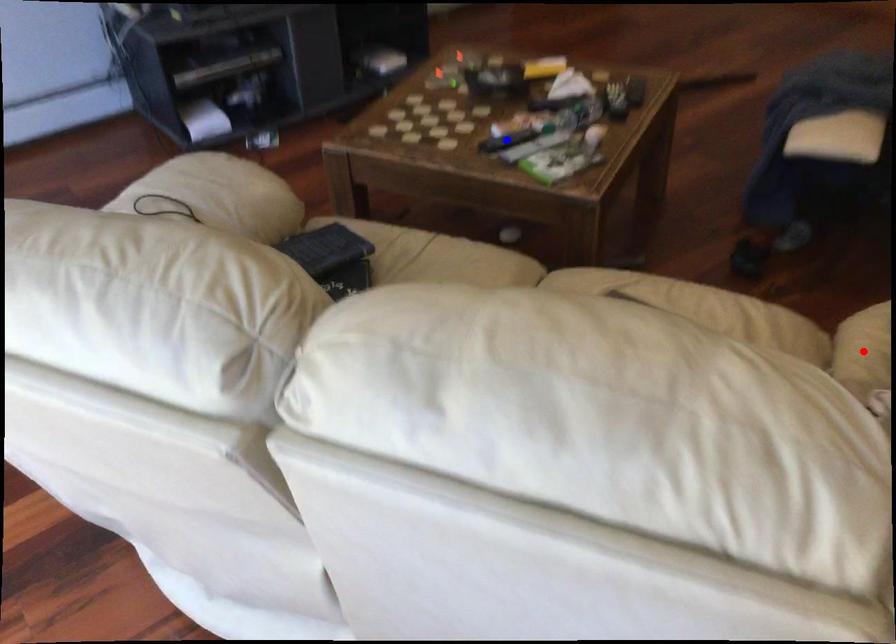
Question: Which of the two points in the image is closer to the camera?

Choices:
 (A) Blue point is closer.
 (B) Red point is closer.

Answer: (B)